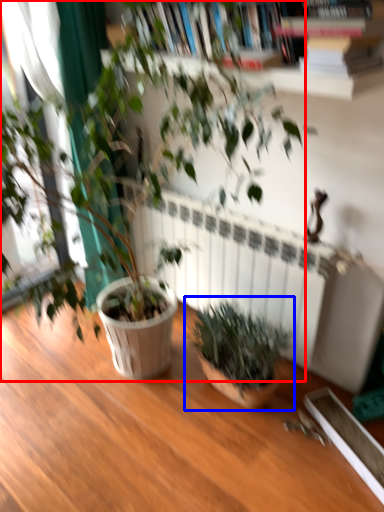
Question: Which object is closer to the camera taking this photo, houseplant (highlighted by a red box) or houseplant (highlighted by a blue box)?

Choices:
 (A) houseplant
 (B) houseplant

Answer: (A)